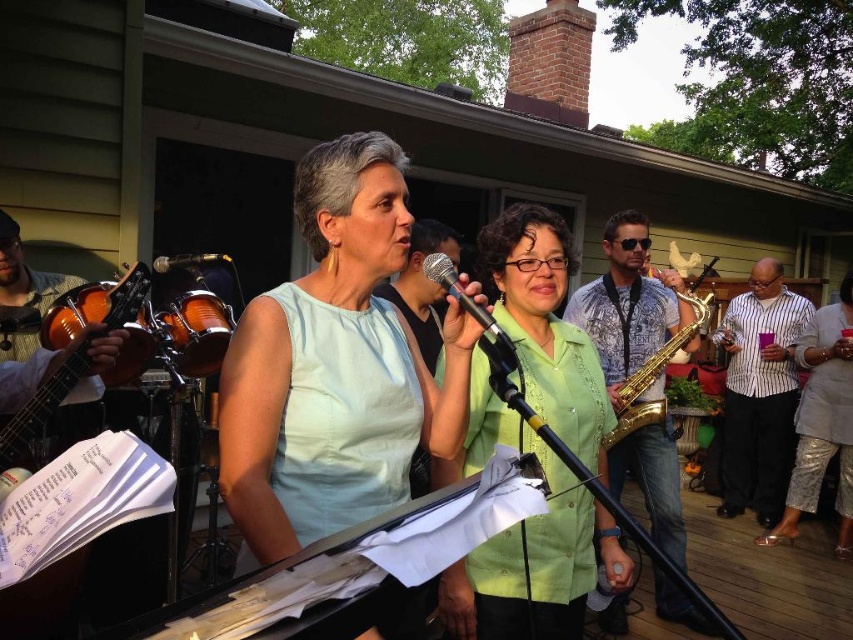
Between black metallic microphone at center and metallic gold saxophone at center, which one appears on the right side from the viewer's perspective?

metallic gold saxophone at center is more to the right.

Who is positioned more to the left, black metallic microphone at center or metallic gold saxophone at center?

black metallic microphone at center is more to the left.

Identify the location of black metallic microphone at center. tap(473, 316).

Is matte brown guitar at left positioned before matte black microphone at center?

Yes, matte brown guitar at left is in front of matte black microphone at center.

Who is more distant from viewer, (x=134, y=356) or (x=204, y=262)?

Positioned behind is point (x=204, y=262).

The width and height of the screenshot is (853, 640). Identify the location of matte brown guitar at left. (105, 321).

Which of these two, matte black microphone at center or metallic gold saxophone at center, stands shorter?

Standing shorter between the two is matte black microphone at center.

Which is in front, point (213, 259) or point (724, 328)?

Point (213, 259) is in front.

Looking at this image, who is more forward, (213, 253) or (726, 349)?

Point (213, 253) is more forward.

This screenshot has height=640, width=853. What are the coordinates of `matte black microphone at center` in the screenshot? It's located at (189, 260).